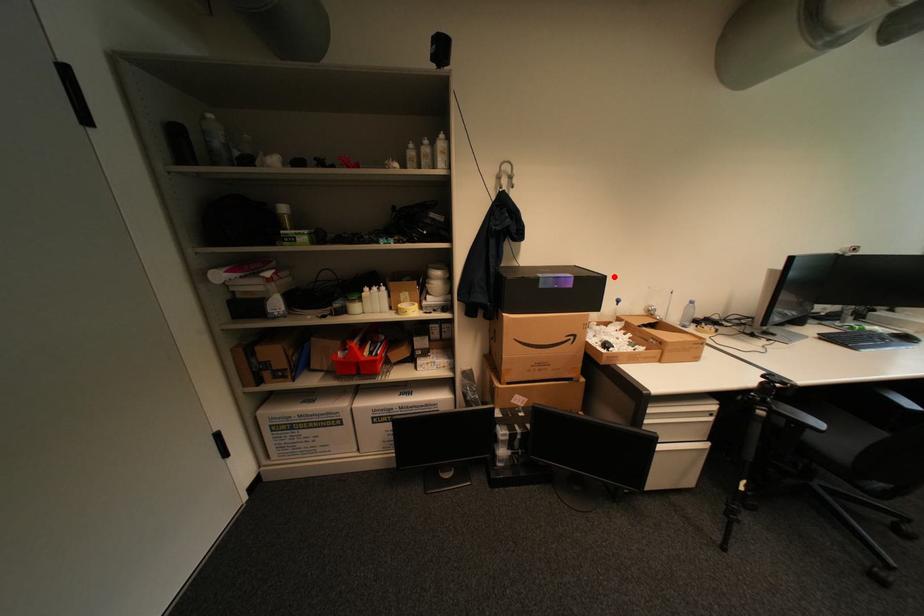
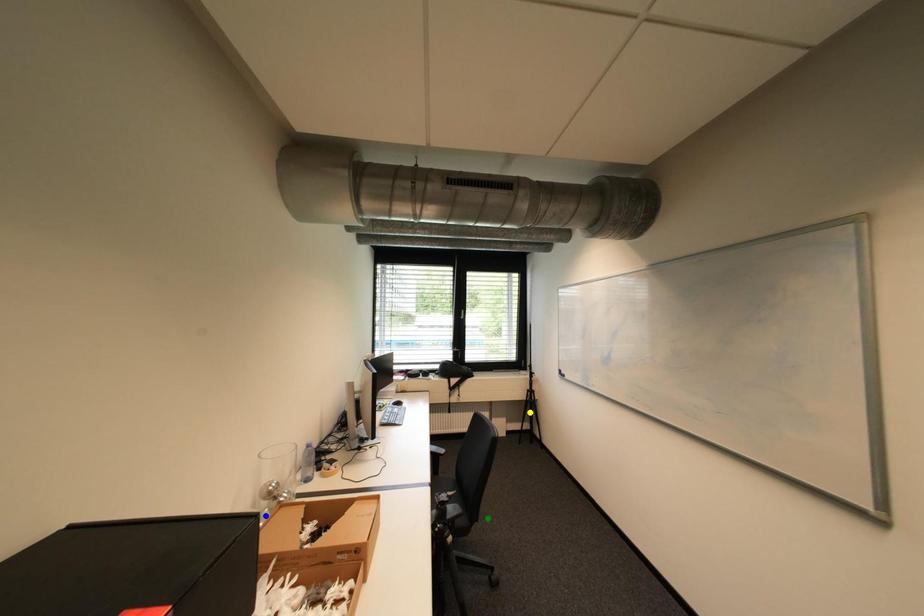
Question: I am providing you with two images of the same scene from different viewpoints. A red point is marked on the first image. You are given multiple points on the second image. In image 2, which mark is for the same physical point as the one in image 1?

Choices:
 (A) blue point
 (B) yellow point
 (C) green point

Answer: (A)